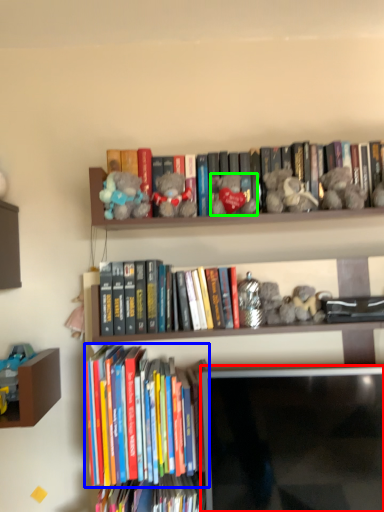
Question: Considering the real-world distances, which object is closest to computer monitor (highlighted by a red box)? book (highlighted by a blue box) or toy (highlighted by a green box).

Choices:
 (A) book
 (B) toy

Answer: (A)